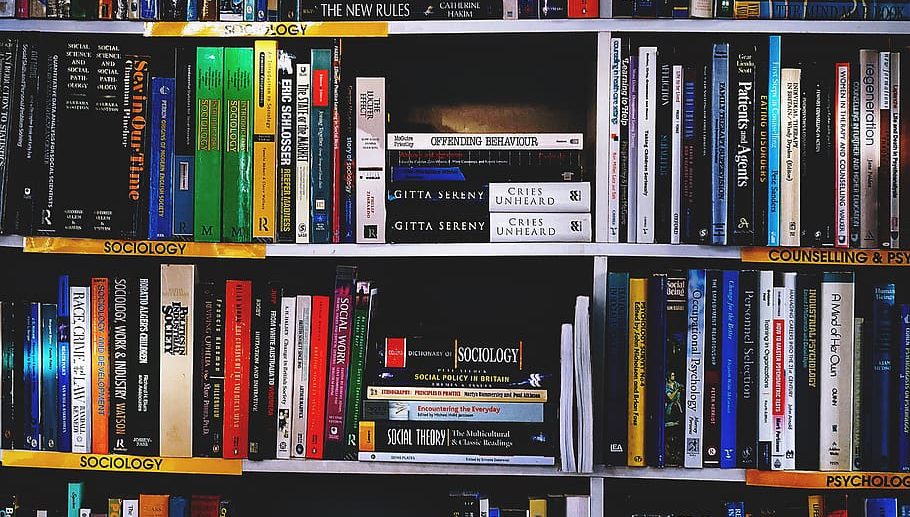
What are the coordinates of `text books` in the screenshot? It's located at (288, 390).